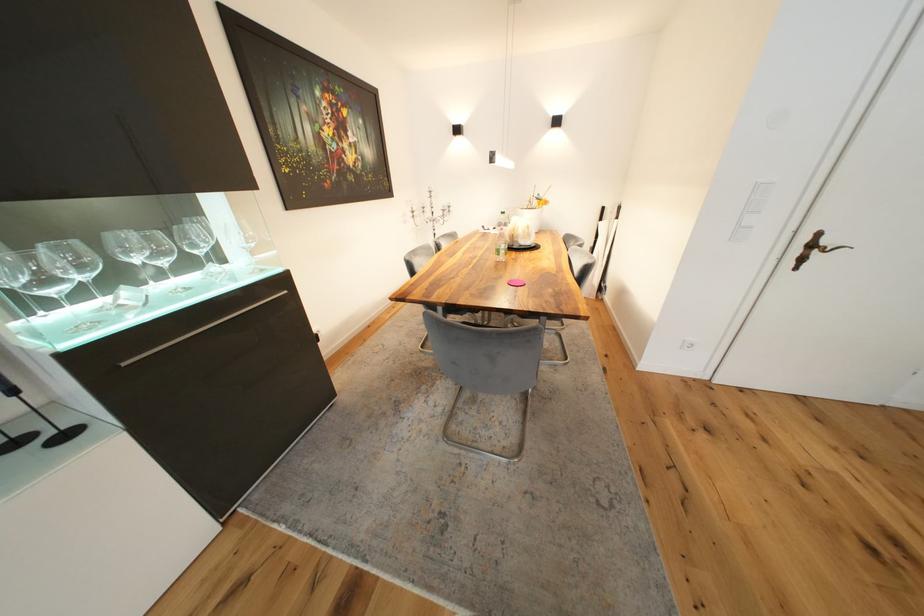
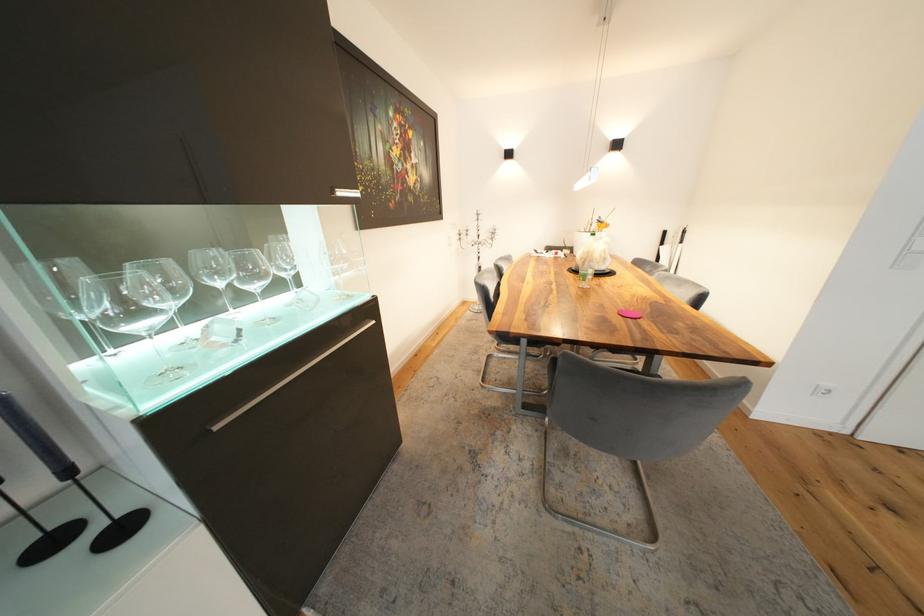
Question: The images are taken continuously from a first-person perspective. In which direction is your viewpoint rotating?

Choices:
 (A) Left
 (B) Right
 (C) Up
 (D) Down

Answer: (C)